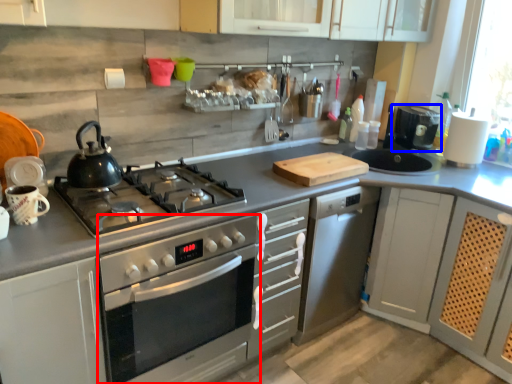
Question: Among these objects, which one is nearest to the camera, oven (highlighted by a red box) or coffee machine (highlighted by a blue box)?

Choices:
 (A) oven
 (B) coffee machine

Answer: (A)